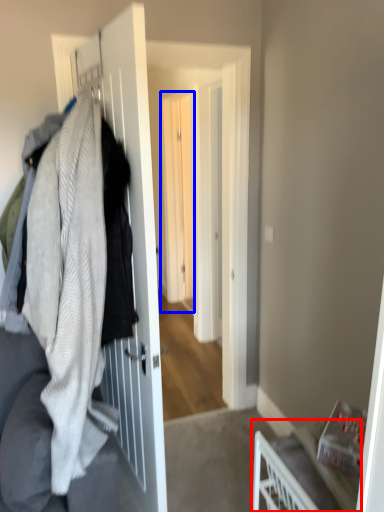
Question: Among these objects, which one is nearest to the camera, furniture (highlighted by a red box) or screen door (highlighted by a blue box)?

Choices:
 (A) furniture
 (B) screen door

Answer: (A)